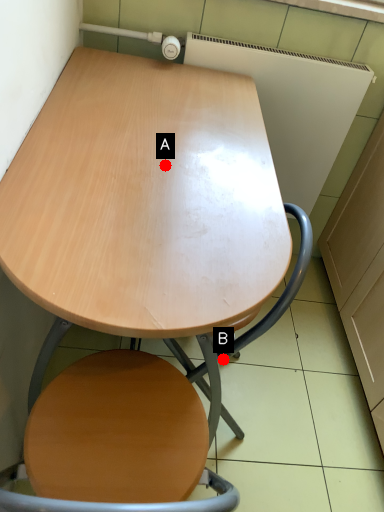
Question: Two points are circled on the image, labeled by A and B beside each circle. Which point is further to the camera?

Choices:
 (A) A is further
 (B) B is further

Answer: (B)